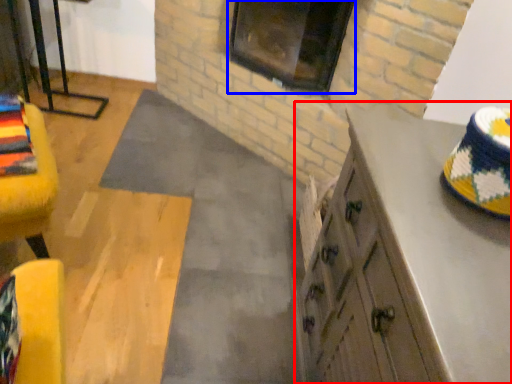
Question: Which object is further to the camera taking this photo, cabinetry (highlighted by a red box) or window (highlighted by a blue box)?

Choices:
 (A) cabinetry
 (B) window

Answer: (B)